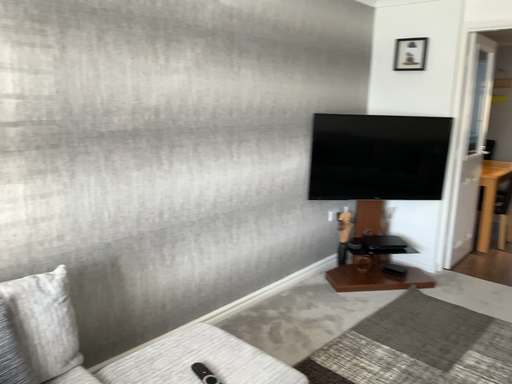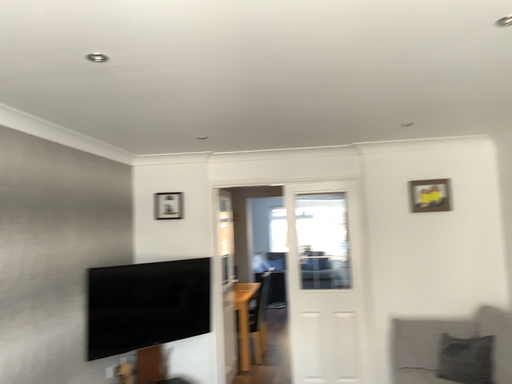
Question: How did the camera likely rotate when shooting the video?

Choices:
 (A) rotated right
 (B) rotated left

Answer: (A)